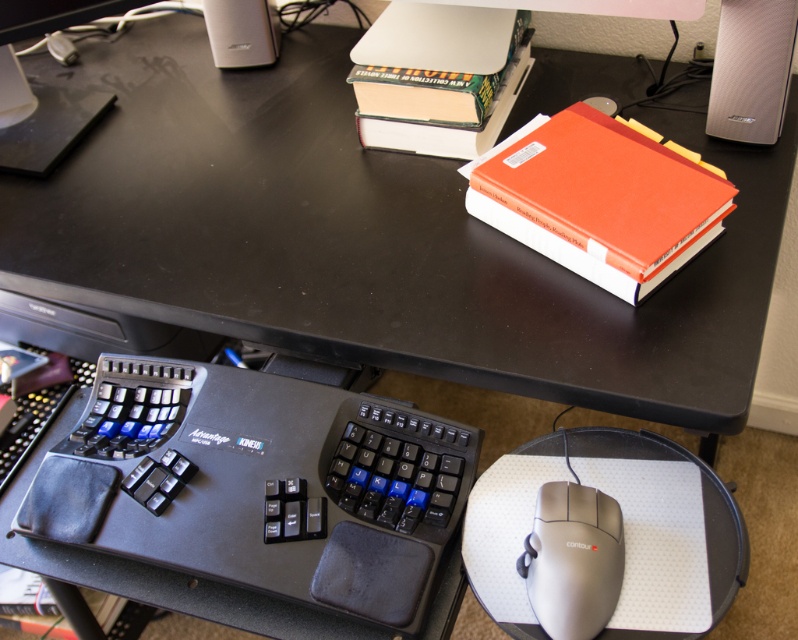
Question: Estimate the real-world distances between objects in this image. Which object is farther from the silver textured speaker at upper right?

Choices:
 (A) satin silver mouse at lower right
 (B) orange matte book at upper right
 (C) matte black speaker at upper left
 (D) black rubberized keyboard at lower left

Answer: (C)

Question: Is black rubberized keyboard at lower left above orange matte book at upper right?

Choices:
 (A) no
 (B) yes

Answer: (A)

Question: Observing the image, what is the correct spatial positioning of satin silver mouse at lower right in reference to silver textured speaker at upper right?

Choices:
 (A) right
 (B) left

Answer: (B)

Question: Is orange matte book at upper right positioned before silver textured speaker at upper right?

Choices:
 (A) yes
 (B) no

Answer: (A)

Question: Which object is closer to the camera taking this photo?

Choices:
 (A) silver textured speaker at upper right
 (B) satin silver mouse at lower right

Answer: (B)

Question: Estimate the real-world distances between objects in this image. Which object is closer to the satin silver mouse at lower right?

Choices:
 (A) black rubberized keyboard at lower left
 (B) matte black speaker at upper left

Answer: (A)